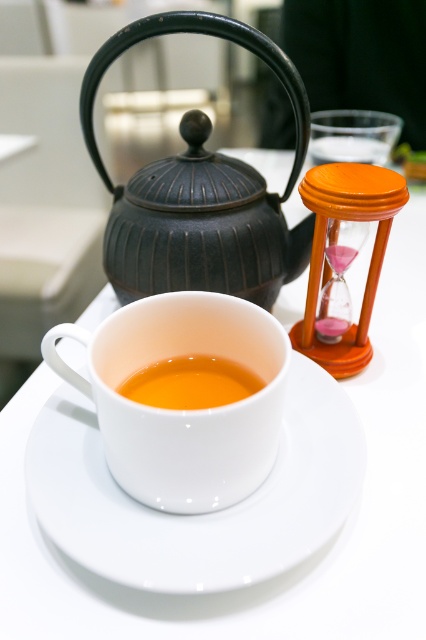
Question: Can you confirm if matte black teapot at upper left is positioned to the right of translucent glass cup at center?

Choices:
 (A) yes
 (B) no

Answer: (A)

Question: Is matte black teapot at upper left wider than white glossy teacup at center?

Choices:
 (A) no
 (B) yes

Answer: (B)

Question: Based on their relative distances, which object is nearer to the white glossy teacup at center?

Choices:
 (A) white glossy saucer at center
 (B) translucent glass cup at center
 (C) matte black teapot at upper left

Answer: (B)

Question: Can you confirm if white glossy teacup at center is smaller than translucent glass cup at center?

Choices:
 (A) yes
 (B) no

Answer: (B)

Question: Which point appears farthest from the camera in this image?

Choices:
 (A) (249, 371)
 (B) (241, 573)

Answer: (A)

Question: Which is nearer to the matte black teapot at upper left?

Choices:
 (A) translucent glass cup at center
 (B) white glossy saucer at center
 (C) white glossy teacup at center

Answer: (C)